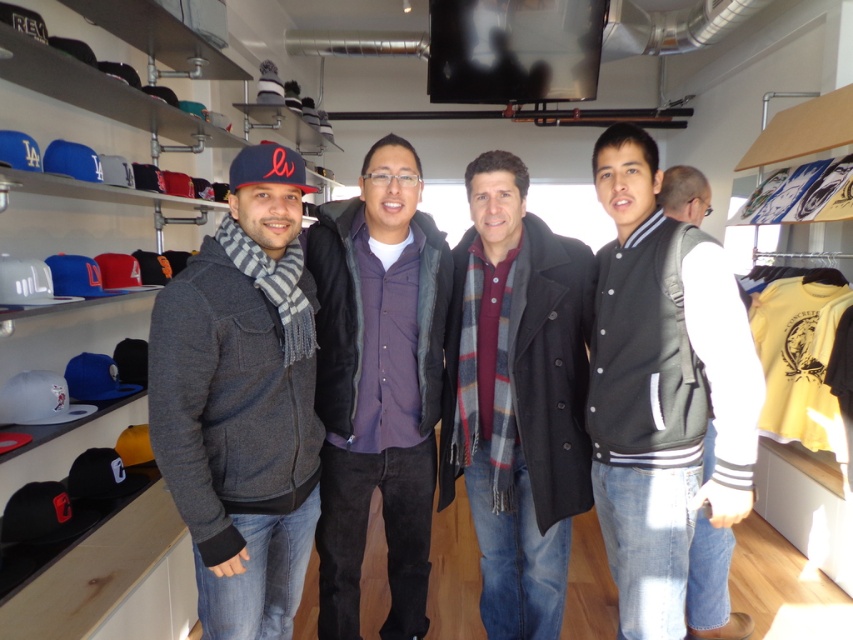
Between point (544, 426) and point (277, 179), which one is positioned behind?

The point (544, 426) is behind.

Is point (553, 621) positioned behind point (268, 141)?

Yes, point (553, 621) is behind point (268, 141).

Locate an element on the screen. plaid scarf at center is located at coordinates (515, 397).

Is point (235, 413) more distant than point (108, 369)?

No, it is not.

Identify the location of gray fleece jacket at left. The height and width of the screenshot is (640, 853). (242, 401).

Does matte black cap at left appear on the right side of white matte baseball cap at left?

No, matte black cap at left is not to the right of white matte baseball cap at left.

Does point (117, 248) come behind point (32, 380)?

Yes, point (117, 248) is farther from viewer.

The width and height of the screenshot is (853, 640). I want to click on matte black cap at left, so click(114, 580).